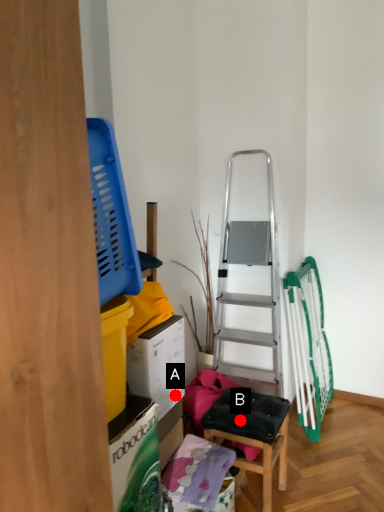
Question: Two points are circled on the image, labeled by A and B beside each circle. Among these points, which one is farthest from the camera?

Choices:
 (A) A is further
 (B) B is further

Answer: (A)